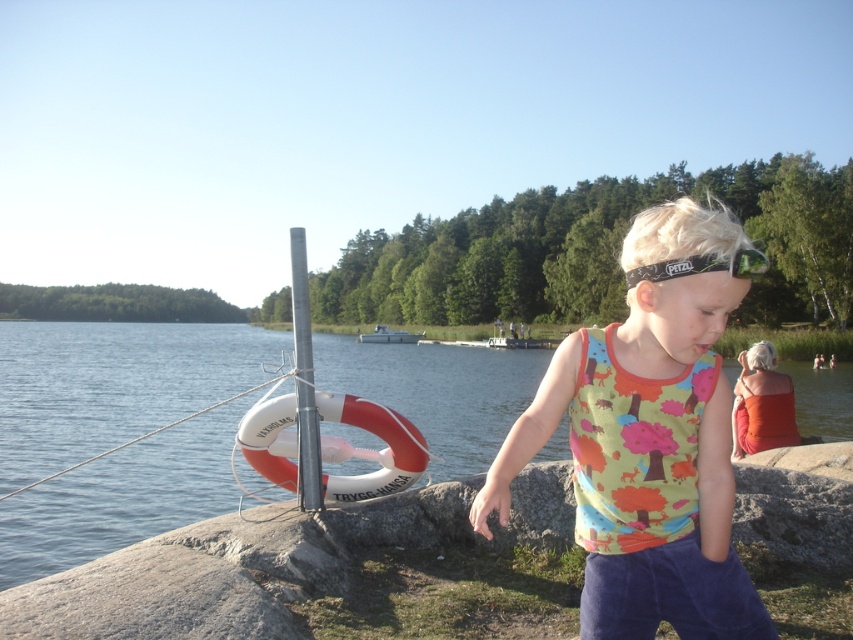
Question: Which of the following is the closest to the observer?

Choices:
 (A) white rubber lifebuoy at left
 (B) orange fabric dress at right

Answer: (A)

Question: Which point is closer to the camera?

Choices:
 (A) white rubber lifebuoy at left
 (B) black fabric headband at center

Answer: (B)

Question: Can you confirm if multicolored fabric tank top at center is positioned above orange fabric dress at right?

Choices:
 (A) no
 (B) yes

Answer: (B)

Question: Among these objects, which one is farthest from the camera?

Choices:
 (A) silver metallic pole at center
 (B) orange fabric dress at right
 (C) black fabric headband at center
 (D) white rubber lifebuoy at left

Answer: (B)

Question: Can you confirm if multicolored fabric tank top at center is positioned to the left of black fabric headband at center?

Choices:
 (A) no
 (B) yes

Answer: (B)

Question: Is multicolored fabric tank top at center behind black fabric headband at center?

Choices:
 (A) no
 (B) yes

Answer: (B)